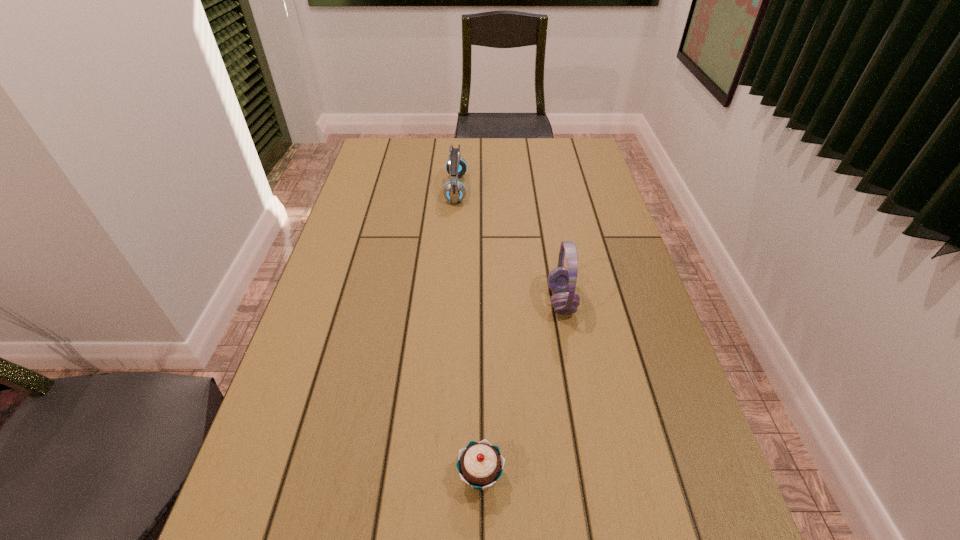
Locate an element on the screen. free spot between the leftmost object and the shortest object is located at coordinates (468, 333).

This screenshot has width=960, height=540. I want to click on unoccupied position between the farthest object and the second nearest object, so click(509, 245).

I want to click on empty location between the second object from left to right and the farther headset, so click(x=468, y=333).

The height and width of the screenshot is (540, 960). I want to click on free space between the shorter headset and the shortest object, so click(x=468, y=333).

Locate an element on the screen. free space between the second shortest object and the second farthest object is located at coordinates (509, 245).

The image size is (960, 540). I want to click on free space between the second object from right to left and the rightmost object, so click(521, 388).

Locate an element on the screen. The image size is (960, 540). the closest object to the shortest object is located at coordinates (561, 280).

Identify which object is the nearest to the cupcake. Please provide its 2D coordinates. Your answer should be formatted as a tuple, i.e. [(x, y)], where the tuple contains the x and y coordinates of a point satisfying the conditions above.

[(561, 280)]

Locate an element on the screen. This screenshot has width=960, height=540. free spot that satisfies the following two spatial constraints: 1. on the ear cups of the leftmost object; 2. on the back side of the cupcake is located at coordinates (436, 476).

Locate an element on the screen. This screenshot has width=960, height=540. vacant space that satisfies the following two spatial constraints: 1. on the ear cups of the farthest object; 2. on the right side of the cupcake is located at coordinates (436, 476).